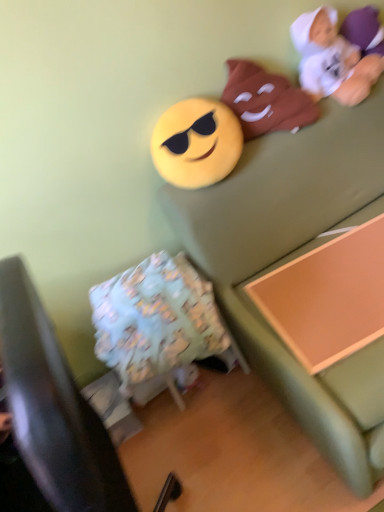
Question: Can you confirm if fluffy fabric pillow at lower left is taller than orange wood changing table at lower right?

Choices:
 (A) no
 (B) yes

Answer: (B)

Question: Is the position of fluffy fabric pillow at lower left less distant than that of orange wood changing table at lower right?

Choices:
 (A) yes
 (B) no

Answer: (A)

Question: Is fluffy fabric pillow at lower left bigger than orange wood changing table at lower right?

Choices:
 (A) no
 (B) yes

Answer: (B)

Question: Could orange wood changing table at lower right be considered to be inside fluffy fabric pillow at lower left?

Choices:
 (A) no
 (B) yes

Answer: (A)

Question: Is fluffy fabric pillow at lower left wider than orange wood changing table at lower right?

Choices:
 (A) no
 (B) yes

Answer: (B)

Question: Considering their positions, is white plush toy at upper right, which is the first toy from right to left, located in front of or behind fluffy fabric pillow at lower left?

Choices:
 (A) front
 (B) behind

Answer: (B)

Question: In terms of height, does white plush toy at upper right, arranged as the 3th toy when viewed from the left, look taller or shorter compared to fluffy fabric pillow at lower left?

Choices:
 (A) short
 (B) tall

Answer: (A)

Question: From the image's perspective, is white plush toy at upper right, arranged as the 3th toy when viewed from the left, positioned above or below fluffy fabric pillow at lower left?

Choices:
 (A) above
 (B) below

Answer: (A)

Question: Is white plush toy at upper right, which is the first toy from right to left, spatially inside fluffy fabric pillow at lower left, or outside of it?

Choices:
 (A) outside
 (B) inside

Answer: (A)

Question: Choose the correct answer: Is soft green couch at upper right inside orange wood changing table at lower right or outside it?

Choices:
 (A) outside
 (B) inside

Answer: (A)

Question: Is soft green couch at upper right wider or thinner than orange wood changing table at lower right?

Choices:
 (A) wide
 (B) thin

Answer: (A)

Question: From the image's perspective, is soft green couch at upper right above or below orange wood changing table at lower right?

Choices:
 (A) above
 (B) below

Answer: (A)

Question: In the image, is soft green couch at upper right positioned in front of or behind orange wood changing table at lower right?

Choices:
 (A) behind
 (B) front

Answer: (B)

Question: Do you think soft green couch at upper right is within yellow matte emoji at upper center, which appears as the third toy when viewed from the right, or outside of it?

Choices:
 (A) outside
 (B) inside

Answer: (A)

Question: From a real-world perspective, is soft green couch at upper right physically located above or below yellow matte emoji at upper center, which is the 1th toy from left to right?

Choices:
 (A) above
 (B) below

Answer: (B)